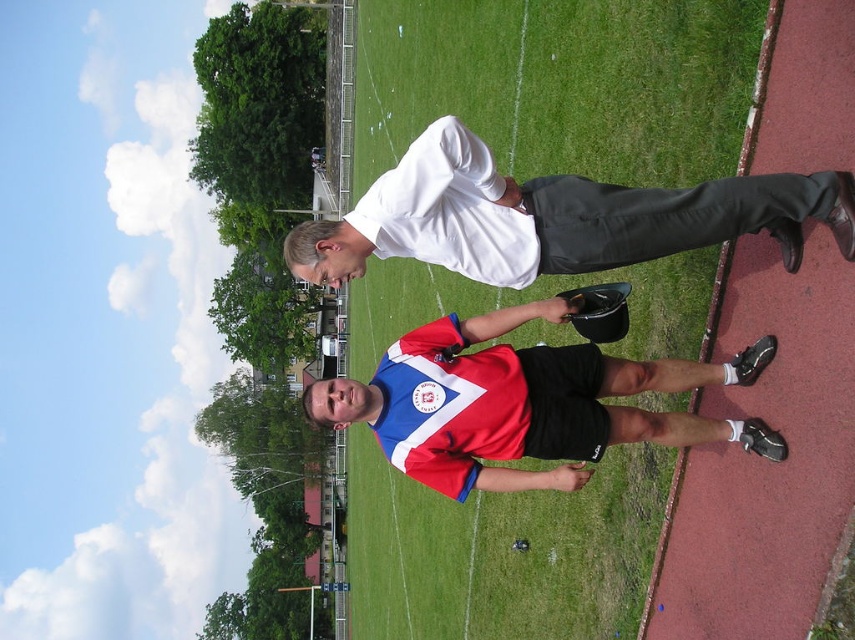
Question: Is green grass at center to the left of red and white jersey at center from the viewer's perspective?

Choices:
 (A) no
 (B) yes

Answer: (B)

Question: Is red and white jersey at center to the right of white matte shirt at upper center from the viewer's perspective?

Choices:
 (A) yes
 (B) no

Answer: (A)

Question: Which point appears closest to the camera in this image?

Choices:
 (A) (614, 529)
 (B) (514, 472)

Answer: (B)

Question: Can you confirm if green grass at center is positioned below red and white jersey at center?

Choices:
 (A) yes
 (B) no

Answer: (B)

Question: Which of the following is the closest to the observer?

Choices:
 (A) white matte shirt at upper center
 (B) green grass at center

Answer: (A)

Question: Estimate the real-world distances between objects in this image. Which object is farther from the red polyester jersey at center?

Choices:
 (A) green grass at center
 (B) white matte shirt at upper center

Answer: (A)